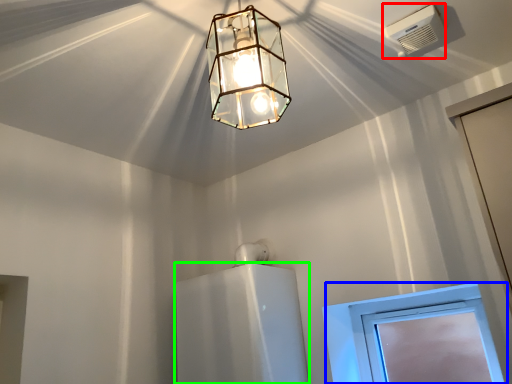
Question: Considering the real-world distances, which object is closest to air conditioning (highlighted by a red box)? window (highlighted by a blue box) or appliance (highlighted by a green box).

Choices:
 (A) window
 (B) appliance

Answer: (A)